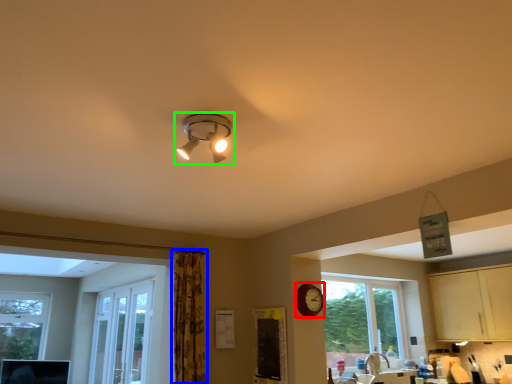
Question: Which is nearer to the clock (highlighted by a red box)? curtain (highlighted by a blue box) or lamp (highlighted by a green box).

Choices:
 (A) curtain
 (B) lamp

Answer: (A)